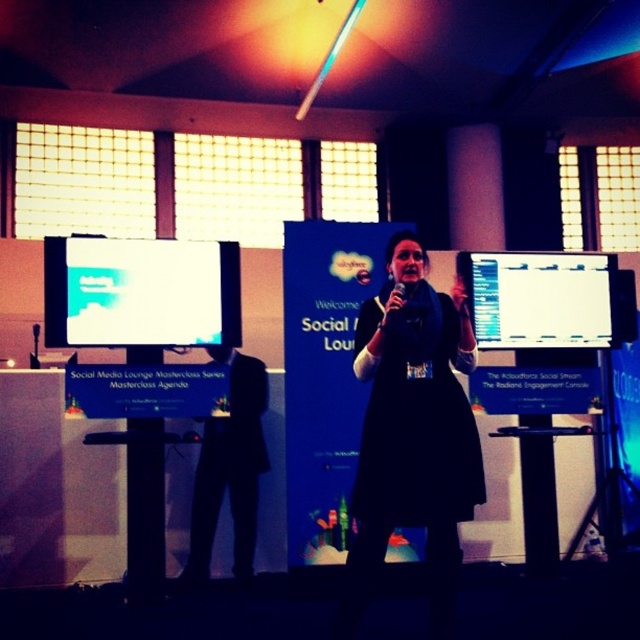
You are an event organizer setting up for a presentation. You have a black suit at center and a white glossy projector screen at left. You need to place a 1.2 meter wide banner between them. Can the banner fit between the two objects?

The white glossy projector screen at left might be wider than the black suit at center. Since the banner is 1.2 meters wide, it could potentially fit between them if the distance between the two objects is at least 1.2 meters. However, without exact measurements, we cannot confirm for sure.